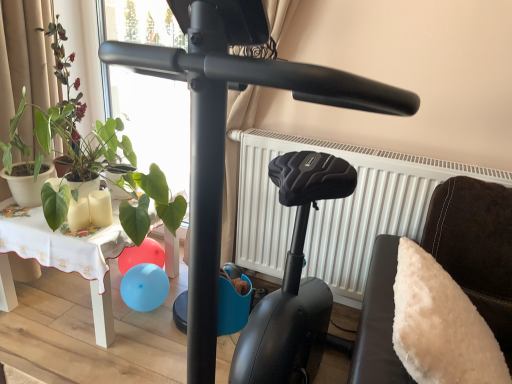
Question: Considering the relative sizes of white matte radiator at center and black matte stationary bicycle at center in the image provided, is white matte radiator at center smaller than black matte stationary bicycle at center?

Choices:
 (A) no
 (B) yes

Answer: (B)

Question: Is white matte radiator at center facing towards black matte stationary bicycle at center?

Choices:
 (A) yes
 (B) no

Answer: (A)

Question: Is white matte radiator at center bigger than black matte stationary bicycle at center?

Choices:
 (A) no
 (B) yes

Answer: (A)

Question: From a real-world perspective, does white matte radiator at center sit lower than black matte stationary bicycle at center?

Choices:
 (A) yes
 (B) no

Answer: (A)

Question: From the image's perspective, is white matte radiator at center beneath black matte stationary bicycle at center?

Choices:
 (A) yes
 (B) no

Answer: (A)

Question: From the image's perspective, is green matte plant at left positioned above or below white matte radiator at center?

Choices:
 (A) above
 (B) below

Answer: (A)

Question: Visually, is green matte plant at left positioned to the left or to the right of white matte radiator at center?

Choices:
 (A) right
 (B) left

Answer: (B)

Question: Choose the correct answer: Is green matte plant at left inside white matte radiator at center or outside it?

Choices:
 (A) outside
 (B) inside

Answer: (A)

Question: Considering the positions of point (16, 185) and point (367, 148), is point (16, 185) closer or farther from the camera than point (367, 148)?

Choices:
 (A) farther
 (B) closer

Answer: (A)

Question: From a real-world perspective, is white fabric-covered table at lower left above or below white fluffy pillow at right?

Choices:
 (A) below
 (B) above

Answer: (A)

Question: From the image's perspective, is white fabric-covered table at lower left positioned above or below white fluffy pillow at right?

Choices:
 (A) below
 (B) above

Answer: (B)

Question: In terms of width, does white fabric-covered table at lower left look wider or thinner when compared to white fluffy pillow at right?

Choices:
 (A) wide
 (B) thin

Answer: (A)

Question: Is white fabric-covered table at lower left spatially inside white fluffy pillow at right, or outside of it?

Choices:
 (A) inside
 (B) outside

Answer: (B)

Question: Would you say green matte plant at left is to the left or to the right of white fabric-covered table at lower left in the picture?

Choices:
 (A) left
 (B) right

Answer: (A)

Question: In terms of width, does green matte plant at left look wider or thinner when compared to white fabric-covered table at lower left?

Choices:
 (A) thin
 (B) wide

Answer: (A)